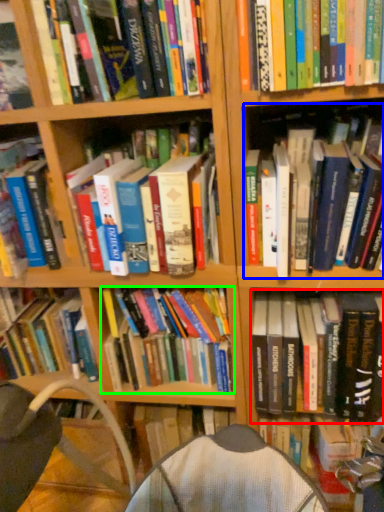
Question: Based on their relative distances, which object is nearer to book (highlighted by a red box)? Choose from book (highlighted by a blue box) and book (highlighted by a green box).

Choices:
 (A) book
 (B) book

Answer: (B)